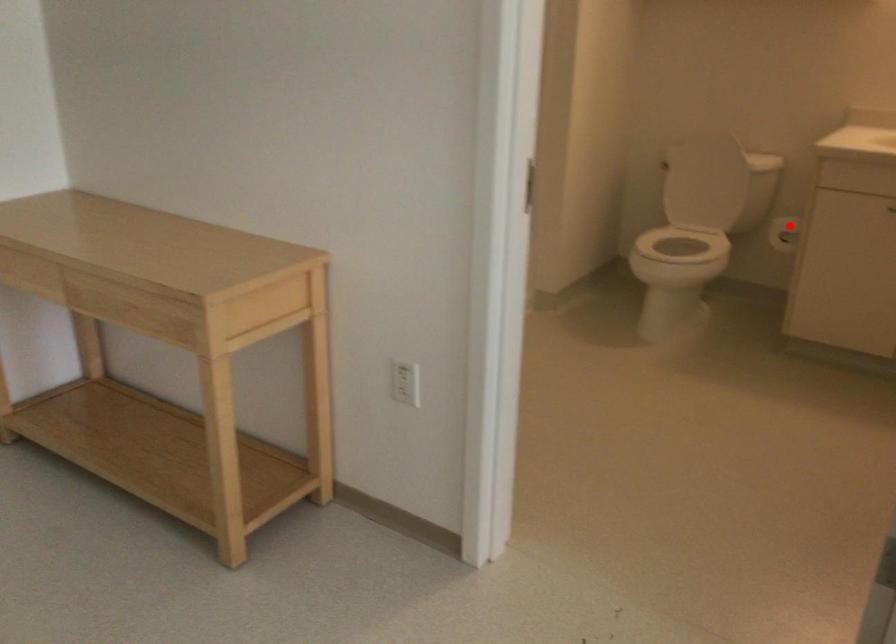
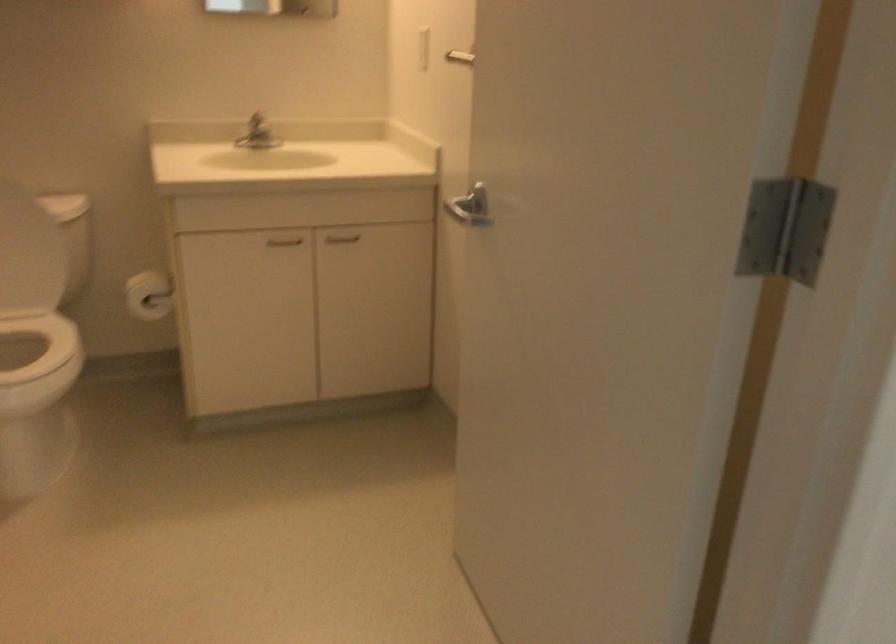
The point at the highlighted location is marked in the first image. Where is the corresponding point in the second image?

(149, 295)